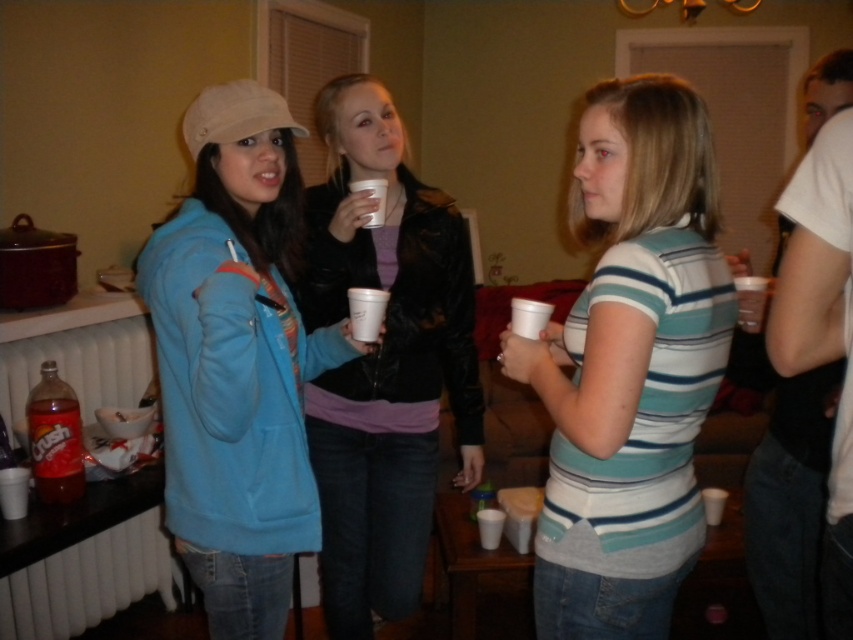
Question: Which of the following is the farthest from the observer?

Choices:
 (A) translucent plastic bottle of crush soda at lower left
 (B) striped cotton shirt at center
 (C) matte blue hoodie at left
 (D) velvet-like black jacket at center

Answer: (D)

Question: Is matte blue hoodie at left smaller than velvet-like black jacket at center?

Choices:
 (A) yes
 (B) no

Answer: (A)

Question: Which point is farther to the camera?

Choices:
 (A) (62, 472)
 (B) (148, 278)
 (C) (349, 138)
 (D) (717, 205)

Answer: (C)

Question: Is striped cotton shirt at center positioned at the back of matte blue hoodie at left?

Choices:
 (A) no
 (B) yes

Answer: (B)

Question: Which point is farther from the camera taking this photo?

Choices:
 (A) (621, 189)
 (B) (442, 355)

Answer: (B)

Question: Does striped cotton shirt at center appear on the left side of velvet-like black jacket at center?

Choices:
 (A) yes
 (B) no

Answer: (B)